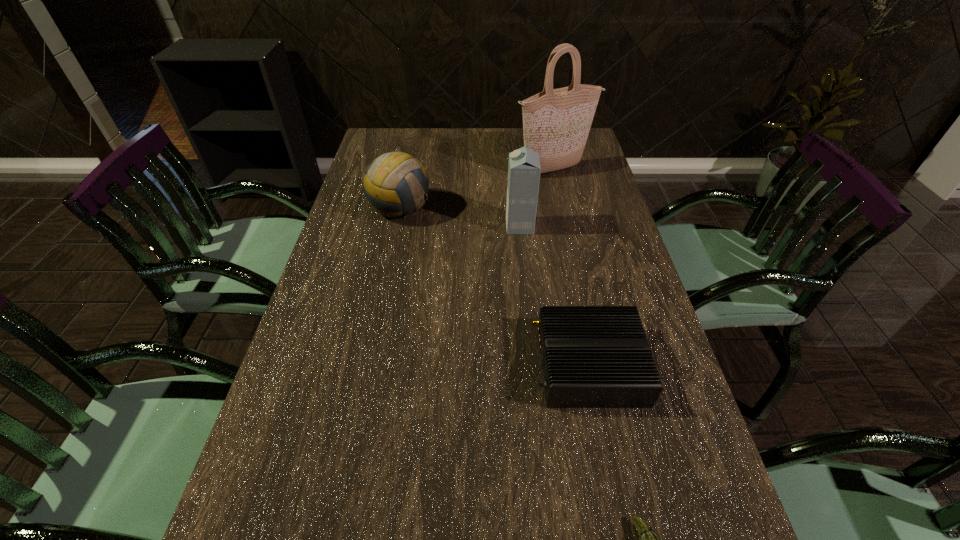
In the image, there is a desktop. In order to click on free space at the far edge in this screenshot , I will do `click(472, 139)`.

This screenshot has width=960, height=540. Find the location of `free space at the left edge of the desktop`. free space at the left edge of the desktop is located at coordinates point(309,321).

Where is `vacant space at the right edge`? The width and height of the screenshot is (960, 540). vacant space at the right edge is located at coordinates (612, 204).

In the image, there is a desktop. At what (x,y) coordinates should I click in order to perform the action: click on vacant space at the far left corner. Please return your answer as a coordinate pair (x, y). Looking at the image, I should click on (382, 135).

I want to click on vacant point located between the shopping bag and the volleyball, so click(477, 188).

In order to click on empty location between the tallest object and the volleyball in this screenshot , I will do `click(477, 188)`.

Locate an element on the screen. The width and height of the screenshot is (960, 540). vacant point located between the leftmost object and the fourth tallest object is located at coordinates (494, 286).

At what (x,y) coordinates should I click in order to perform the action: click on unoccupied position between the volleyball and the second nearest object. Please return your answer as a coordinate pair (x, y). The image size is (960, 540). Looking at the image, I should click on (494, 286).

Locate an element on the screen. object that stands as the third closest to the shortest object is located at coordinates (396, 184).

Locate an element on the screen. the closest object relative to the second nearest object is located at coordinates (648, 539).